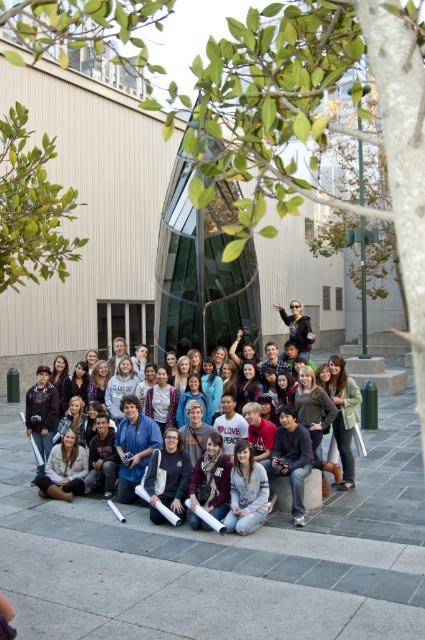
What do you see at coordinates (325, 413) in the screenshot? I see `matte black jacket at center` at bounding box center [325, 413].

Is point (309, 428) more distant than point (243, 518)?

Yes, point (309, 428) is farther from viewer.

Where is `matte black jacket at center`? matte black jacket at center is located at coordinates (325, 413).